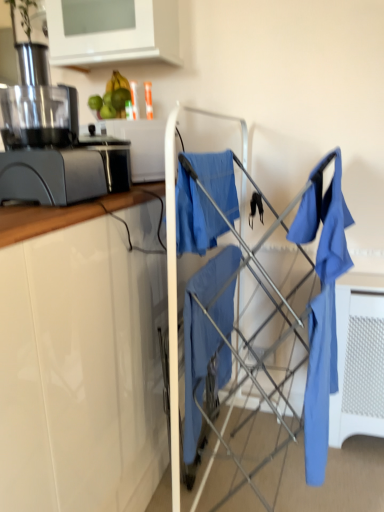
The height and width of the screenshot is (512, 384). Describe the element at coordinates (322, 307) in the screenshot. I see `matte blue shirt at right` at that location.

This screenshot has width=384, height=512. What do you see at coordinates (112, 98) in the screenshot? I see `green matte avocado at upper center` at bounding box center [112, 98].

Image resolution: width=384 pixels, height=512 pixels. In order to click on matte blue fabric at center in this screenshot , I will do `click(176, 276)`.

Where is `matte blue shirt at right`? Image resolution: width=384 pixels, height=512 pixels. matte blue shirt at right is located at coordinates (322, 307).

Is white glossy cabinet at upper left far away from matte blue fabric at center?

No, white glossy cabinet at upper left is not far away from matte blue fabric at center.

Can you confirm if white glossy cabinet at upper left is smaller than matte blue fabric at center?

Yes.

Which is in front, white glossy cabinet at upper left or matte blue fabric at center?

matte blue fabric at center is more forward.

Between white glossy cabinet at upper left and matte blue fabric at center, which one has less height?

white glossy cabinet at upper left is shorter.

Between blue fabric at center and matte blue shirt at right, which one appears on the right side from the viewer's perspective?

matte blue shirt at right is more to the right.

Considering the positions of objects blue fabric at center and matte blue shirt at right in the image provided, who is in front, blue fabric at center or matte blue shirt at right?

matte blue shirt at right.

From the image's perspective, is blue fabric at center located above matte blue shirt at right?

Correct, blue fabric at center appears higher than matte blue shirt at right in the image.

Could you tell me if matte blue fabric at center is turned towards matte gray toaster at left?

No, matte blue fabric at center does not turn towards matte gray toaster at left.

How different are the orientations of matte blue fabric at center and matte gray toaster at left in degrees?

89.4 degrees separate the facing orientations of matte blue fabric at center and matte gray toaster at left.

In the scene shown: Is matte blue fabric at center to the right of matte gray toaster at left from the viewer's perspective?

Yes.

Can you confirm if matte blue fabric at center is taller than matte gray toaster at left?

Yes.

What's the angular difference between matte blue fabric at center and green matte avocado at upper center's facing directions?

There is a 6.05-degree angle between the facing directions of matte blue fabric at center and green matte avocado at upper center.

Who is more distant, matte blue fabric at center or green matte avocado at upper center?

green matte avocado at upper center is further from the camera.

Which is in front, point (236, 118) or point (111, 101)?

The point (111, 101) is more forward.

Does point (306, 227) come behind point (92, 194)?

No, (306, 227) is in front of (92, 194).

Can you see matte blue shirt at right touching matte gray toaster at left?

There is a gap between matte blue shirt at right and matte gray toaster at left.

From the image's perspective, is matte blue shirt at right beneath matte gray toaster at left?

Correct, matte blue shirt at right appears lower than matte gray toaster at left in the image.

Can you confirm if matte blue fabric at center is positioned to the right of matte blue shirt at right?

No, matte blue fabric at center is not to the right of matte blue shirt at right.

Is matte blue fabric at center aimed at matte blue shirt at right?

No, matte blue fabric at center is not aimed at matte blue shirt at right.

Can we say matte blue fabric at center lies outside matte blue shirt at right?

Yes.

Considering the sizes of objects matte gray juicer at left and matte blue fabric at center in the image provided, who is wider, matte gray juicer at left or matte blue fabric at center?

With larger width is matte blue fabric at center.

How much distance is there between matte gray juicer at left and matte blue fabric at center?

matte gray juicer at left and matte blue fabric at center are 36.31 centimeters apart.

Considering the positions of objects matte gray juicer at left and matte blue fabric at center in the image provided, who is behind, matte gray juicer at left or matte blue fabric at center?

matte blue fabric at center is more distant.

From the image's perspective, is matte gray juicer at left located above or below matte blue fabric at center?

matte gray juicer at left is situated higher than matte blue fabric at center in the image.

Locate an element on the screen. This screenshot has height=512, width=384. baby carriage to the right of white glossy cabinet at upper left is located at coordinates (176, 276).

Locate an element on the screen. The height and width of the screenshot is (512, 384). clothe above the matte blue shirt at right (from the image's perspective) is located at coordinates (195, 217).

Estimate the real-world distances between objects in this image. Which object is closer to blue fabric at center, matte blue shirt at right or matte blue fabric at center?

matte blue fabric at center.

When comparing their distances from green matte avocado at upper center, does matte gray toaster at left or white glossy cabinet at upper left seem further?

Among the two, matte gray toaster at left is located further to green matte avocado at upper center.

Based on their spatial positions, is blue fabric at center or green matte avocado at upper center further from matte gray toaster at left?

Among the two, green matte avocado at upper center is located further to matte gray toaster at left.

Which object lies further to the anchor point white glossy cabinet at upper left, matte gray juicer at left or green matte avocado at upper center?

matte gray juicer at left is positioned further to the anchor white glossy cabinet at upper left.

Looking at the image, which one is located further to matte blue shirt at right, matte gray juicer at left or matte gray toaster at left?

Based on the image, matte gray juicer at left appears to be further to matte blue shirt at right.

Estimate the real-world distances between objects in this image. Which object is closer to matte blue fabric at center, matte blue shirt at right or matte gray juicer at left?

matte gray juicer at left is closer to matte blue fabric at center.

From the image, which object appears to be nearer to matte blue fabric at center, white glossy cabinet at upper left or blue fabric at center?

blue fabric at center is positioned closer to the anchor matte blue fabric at center.

In the scene shown: Based on their spatial positions, is matte blue shirt at right or green matte avocado at upper center further from blue fabric at center?

The object further to blue fabric at center is green matte avocado at upper center.

Locate an element on the screen. kitchen appliance between matte gray juicer at left and matte blue fabric at center is located at coordinates (65, 172).

Locate an element on the screen. kitchen appliance between matte gray juicer at left and matte blue shirt at right from left to right is located at coordinates (65, 172).

The width and height of the screenshot is (384, 512). What are the coordinates of `baby carriage situated between matte gray juicer at left and matte blue shirt at right from left to right` in the screenshot? It's located at (176, 276).

The image size is (384, 512). I want to click on home appliance between green matte avocado at upper center and matte blue fabric at center in the up-down direction, so tap(47, 149).